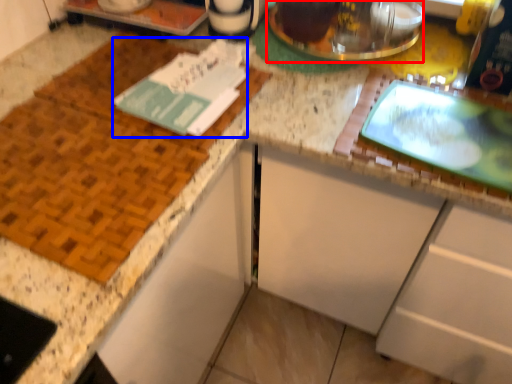
Question: Which point is closer to the camera, appliance (highlighted by a red box) or journal (highlighted by a blue box)?

Choices:
 (A) appliance
 (B) journal

Answer: (B)